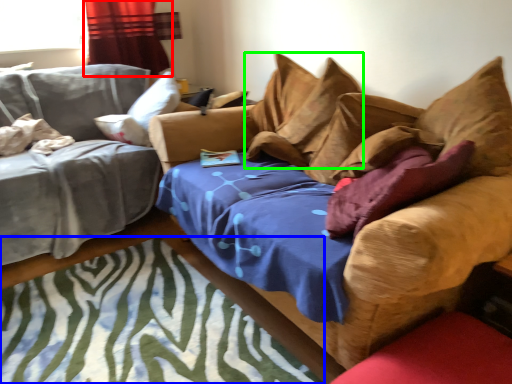
Question: Estimate the real-world distances between objects in this image. Which object is closer to curtain (highlighted by a red box), mat (highlighted by a blue box) or pillow (highlighted by a green box)?

Choices:
 (A) mat
 (B) pillow

Answer: (B)